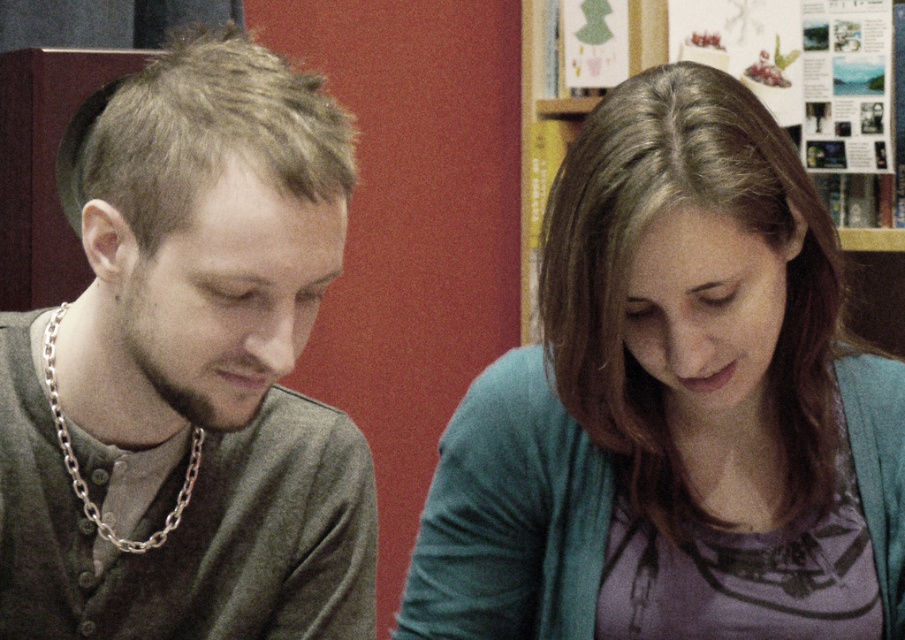
You are a photographer setting up a shoot in this room. You want to ensure that both the purple cotton shirt at center and the wooden bookshelf at upper center are visible in the frame. Based on their positions, which object should you focus on first to include both in the shot?

The purple cotton shirt at center is positioned under the wooden bookshelf at upper center, so focusing on the wooden bookshelf at upper center first would allow both objects to be captured in the frame.

You are an interior designer arranging furniture in this room. You need to move the purple cotton shirt at center and the matte gray sweater at left so that the sweater is no longer behind the shirt. How should you adjust their positions?

To ensure the matte gray sweater at left is no longer behind the purple cotton shirt at center, move the matte gray sweater at left to a position in front of or to the side of the purple cotton shirt at center.

You are standing in the room and want to reach the point at coordinates (567, 602). If your arm can extend 80 centimeters, can you reach that point without moving closer?

The point at coordinates (567, 602) is 91.48 centimeters away from the viewer. Since your arm can only extend 80 centimeters, you cannot reach it without moving closer.